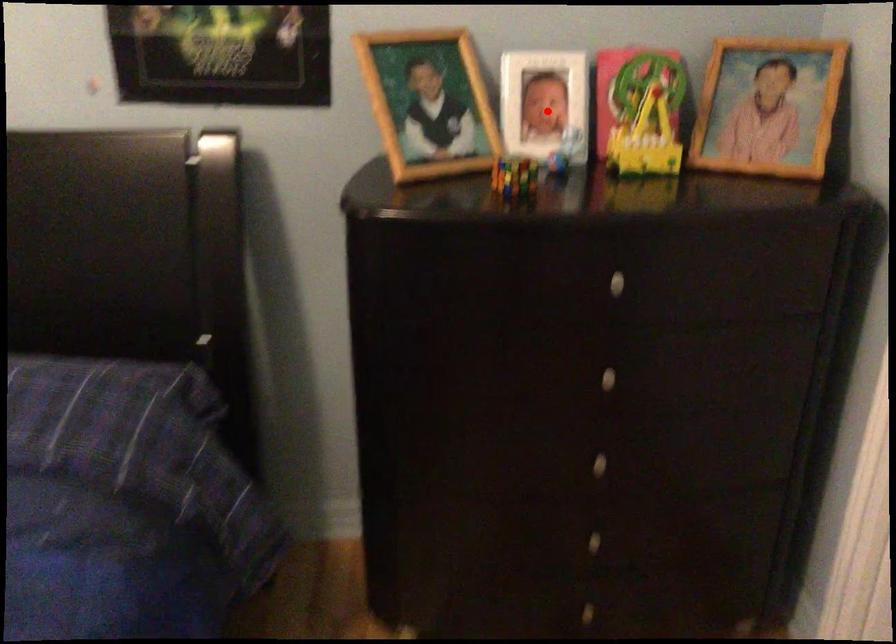
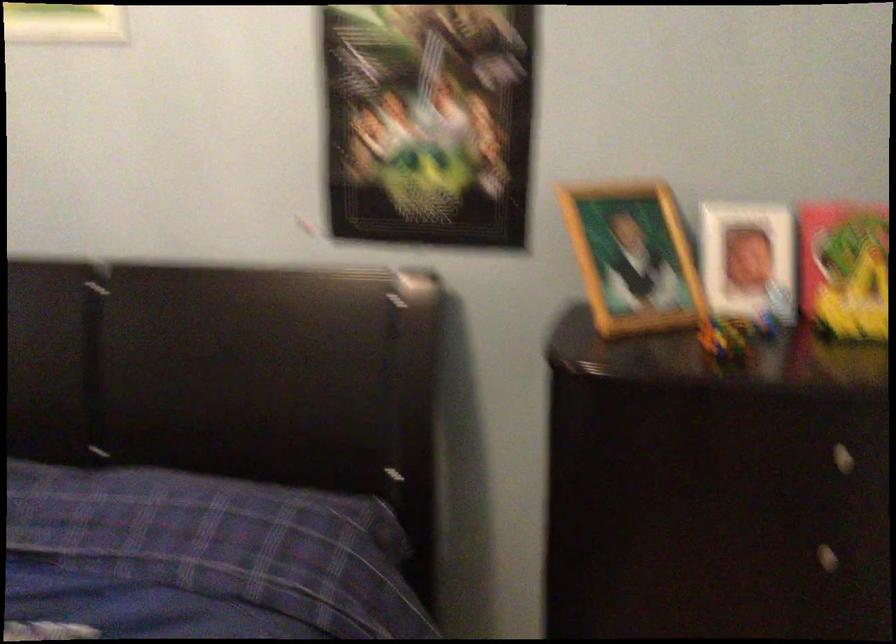
The point at the highlighted location is marked in the first image. Where is the corresponding point in the second image?

(748, 261)